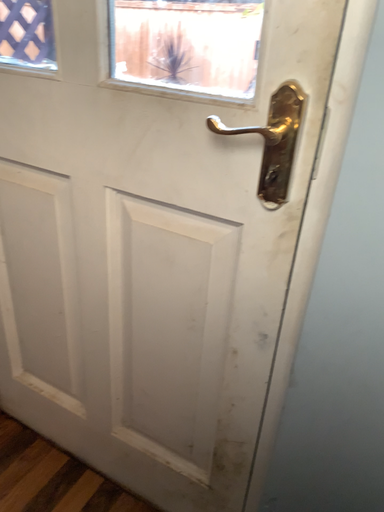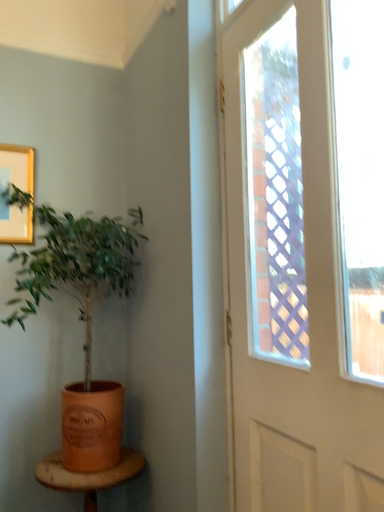
Question: Which way did the camera rotate in the video?

Choices:
 (A) rotated downward
 (B) rotated upward

Answer: (B)